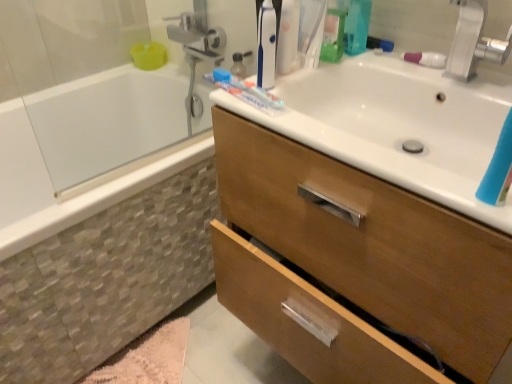
Question: From their relative heights in the image, would you say white glossy sink at upper right is taller or shorter than translucent plastic toothpaste at upper center?

Choices:
 (A) short
 (B) tall

Answer: (A)

Question: From the image's perspective, is white glossy sink at upper right positioned above or below translucent plastic toothpaste at upper center?

Choices:
 (A) below
 (B) above

Answer: (A)

Question: Which of these objects is positioned farthest from the translucent plastic toothpaste at upper center?

Choices:
 (A) white glossy bathtub at left
 (B) silver metallic faucet at upper right
 (C) pink fluffy bath mat at lower left
 (D) wooden cabinet at upper right
 (E) pink plastic toothbrush at upper right

Answer: (C)

Question: Considering the real-world distances, which object is closest to the translucent plastic toothpaste at upper center?

Choices:
 (A) pink plastic toothbrush at upper right
 (B) blue plastic toothbrush at upper center
 (C) wooden cabinet at upper right
 (D) pink fluffy bath mat at lower left
 (E) white glossy sink at upper right

Answer: (B)